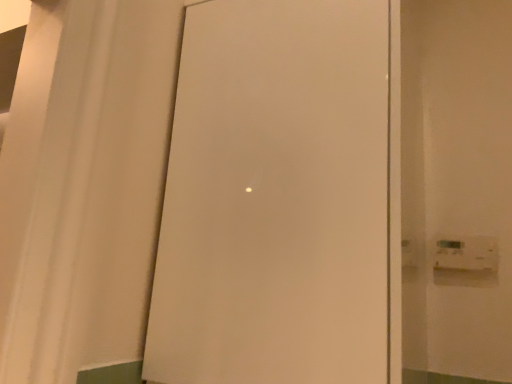
The width and height of the screenshot is (512, 384). Describe the element at coordinates (466, 253) in the screenshot. I see `white plastic light switch at right` at that location.

Locate an element on the screen. Image resolution: width=512 pixels, height=384 pixels. white plastic light switch at right is located at coordinates (466, 253).

This screenshot has height=384, width=512. Find the location of `white matte door at center`. white matte door at center is located at coordinates click(x=276, y=198).

Consider the image. In order to face white matte door at center, should I rotate leftwards or rightwards?

You should look right and rotate roughly 6.532 degrees.

What is the approximate width of white matte door at center?

The width of white matte door at center is 17.54 inches.

This screenshot has height=384, width=512. What do you see at coordinates (276, 198) in the screenshot?
I see `white matte door at center` at bounding box center [276, 198].

This screenshot has width=512, height=384. I want to click on white plastic light switch at right, so click(466, 253).

Is white matte door at center at the right side of white plastic light switch at right?

Incorrect, white matte door at center is not on the right side of white plastic light switch at right.

In the image, is white matte door at center positioned in front of or behind white plastic light switch at right?

white matte door at center is positioned closer to the viewer than white plastic light switch at right.

Does point (289, 138) appear closer or farther from the camera than point (446, 252)?

Point (289, 138) is positioned closer to the camera compared to point (446, 252).

From the image's perspective, is white matte door at center above or below white plastic light switch at right?

Based on their image positions, white matte door at center is located above white plastic light switch at right.

From a real-world perspective, is white matte door at center physically below white plastic light switch at right?

No, from a real-world perspective, white matte door at center is not below white plastic light switch at right.

Is white matte door at center wider than white plastic light switch at right?

Indeed, white matte door at center has a greater width compared to white plastic light switch at right.

Who is taller, white matte door at center or white plastic light switch at right?

With more height is white matte door at center.

Considering the sizes of objects white matte door at center and white plastic light switch at right in the image provided, who is bigger, white matte door at center or white plastic light switch at right?

Bigger between the two is white matte door at center.

Is white matte door at center positioned beyond the bounds of white plastic light switch at right?

white matte door at center lies outside white plastic light switch at right's area.

Are white matte door at center and white plastic light switch at right located far from each other?

No, there isn't a large distance between white matte door at center and white plastic light switch at right.

Is white matte door at center facing towards white plastic light switch at right?

No, white matte door at center does not turn towards white plastic light switch at right.

What's the angular difference between white matte door at center and white plastic light switch at right's facing directions?

white matte door at center and white plastic light switch at right are facing 0.656 degrees away from each other.

The image size is (512, 384). I want to click on door above the white plastic light switch at right (from the image's perspective), so click(276, 198).

Which is more to the right, white plastic light switch at right or white matte door at center?

white plastic light switch at right is more to the right.

Is white plastic light switch at right further to the viewer compared to white matte door at center?

Yes, white plastic light switch at right is further from the viewer.

Does point (461, 247) appear closer or farther from the camera than point (172, 132)?

Point (461, 247).

From the image's perspective, which one is positioned lower, white plastic light switch at right or white matte door at center?

white plastic light switch at right is shown below in the image.

From a real-world perspective, is white plastic light switch at right physically located above or below white matte door at center?

white plastic light switch at right is below white matte door at center.

In terms of width, does white plastic light switch at right look wider or thinner when compared to white matte door at center?

white plastic light switch at right is thinner than white matte door at center.

Does white plastic light switch at right have a greater height compared to white matte door at center?

Incorrect, the height of white plastic light switch at right is not larger of that of white matte door at center.

Based on their sizes in the image, would you say white plastic light switch at right is bigger or smaller than white matte door at center?

Considering their sizes, white plastic light switch at right takes up less space than white matte door at center.

Is white plastic light switch at right surrounding white matte door at center?

Definitely not — white matte door at center is not inside white plastic light switch at right.

Are white plastic light switch at right and white matte door at center far apart?

No, white plastic light switch at right is not far away from white matte door at center.

Is white plastic light switch at right turned away from white matte door at center?

That's not correct — white plastic light switch at right is not looking away from white matte door at center.

The width and height of the screenshot is (512, 384). I want to click on light switch below the white matte door at center (from a real-world perspective), so click(x=466, y=253).

Locate an element on the screen. door that appears in front of the white plastic light switch at right is located at coordinates (276, 198).

In order to click on door above the white plastic light switch at right (from a real-world perspective) in this screenshot , I will do pos(276,198).